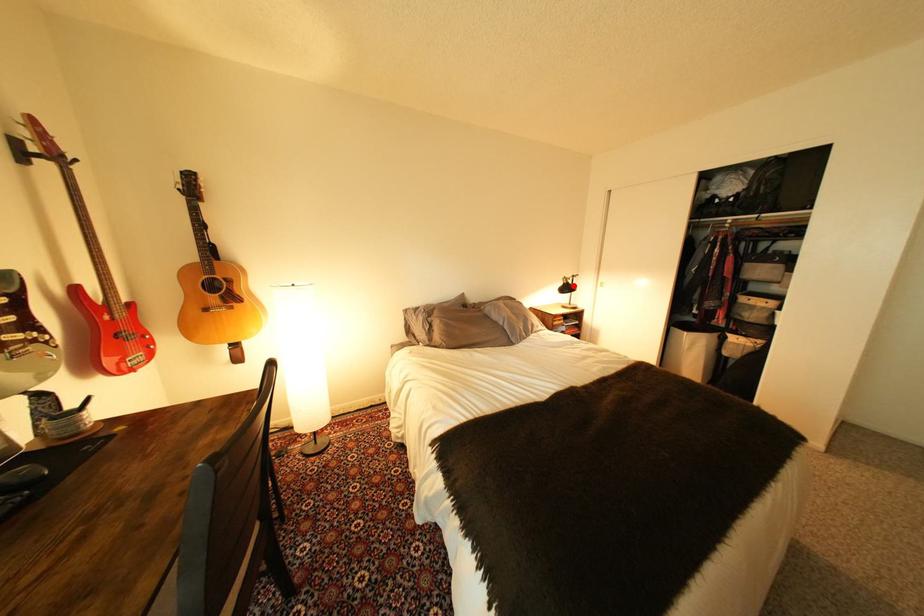
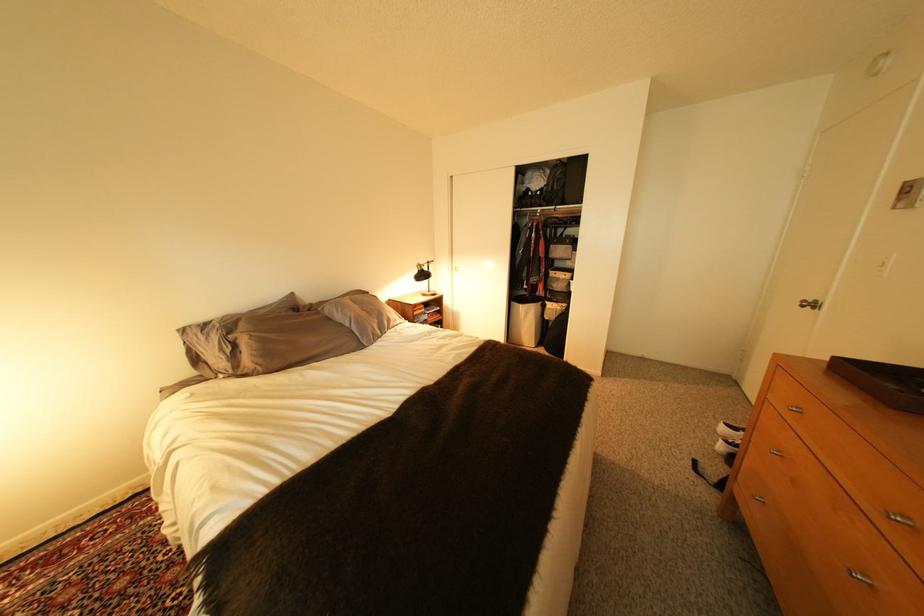
Question: I am providing you with two images of the same scene from different viewpoints. Given a red point in image1, look at the same physical point in image2. Is it:

Choices:
 (A) Closer to the viewpoint
 (B) Farther from the viewpoint

Answer: (A)